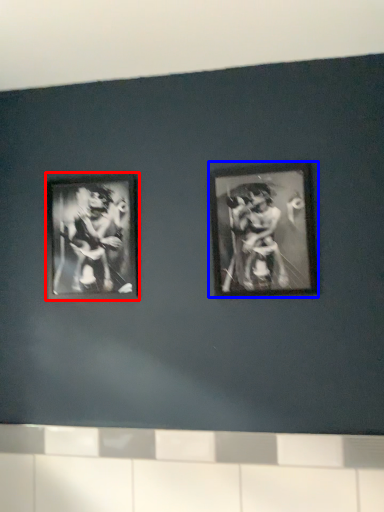
Question: Among these objects, which one is nearest to the camera, picture frame (highlighted by a red box) or picture frame (highlighted by a blue box)?

Choices:
 (A) picture frame
 (B) picture frame

Answer: (B)